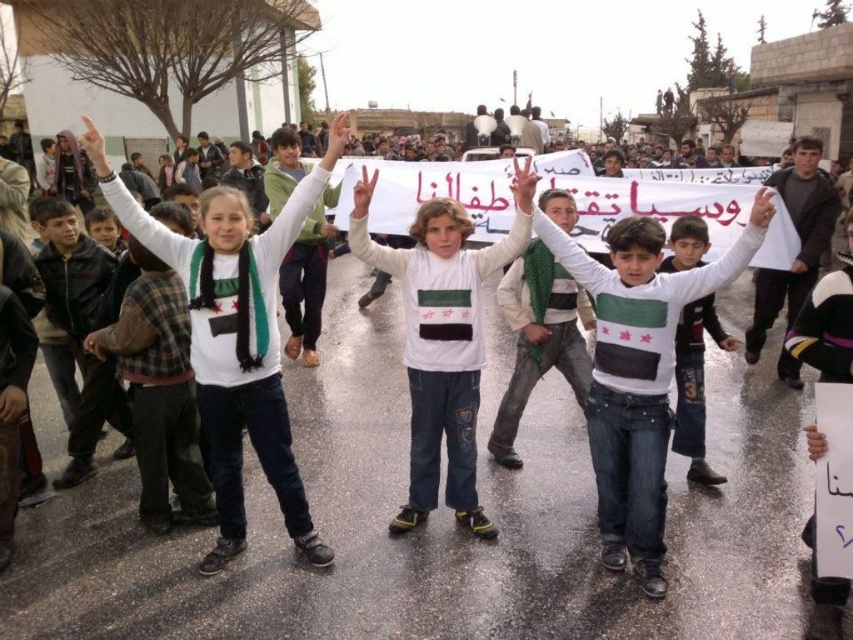
Does point (669, 420) lie behind point (698, 337)?

That is False.

Can you confirm if white cotton shirt at center is positioned to the left of white sweater at center?

Correct, you'll find white cotton shirt at center to the left of white sweater at center.

Does point (746, 225) lie in front of point (688, 388)?

Yes.

You are a GUI agent. You are given a task and a screenshot of the screen. Output one action in this format:
    pyautogui.click(x=<x>, y=<y>)
    Task: Click on the white cotton shirt at center
    The height and width of the screenshot is (640, 853).
    Given the screenshot: What is the action you would take?
    pyautogui.click(x=639, y=372)